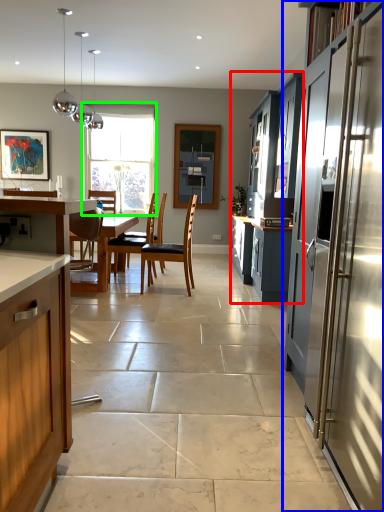
Question: Which object is the closest to the cabinetry (highlighted by a red box)? Choose among these: cabinetry (highlighted by a blue box) or window (highlighted by a green box).

Choices:
 (A) cabinetry
 (B) window

Answer: (A)